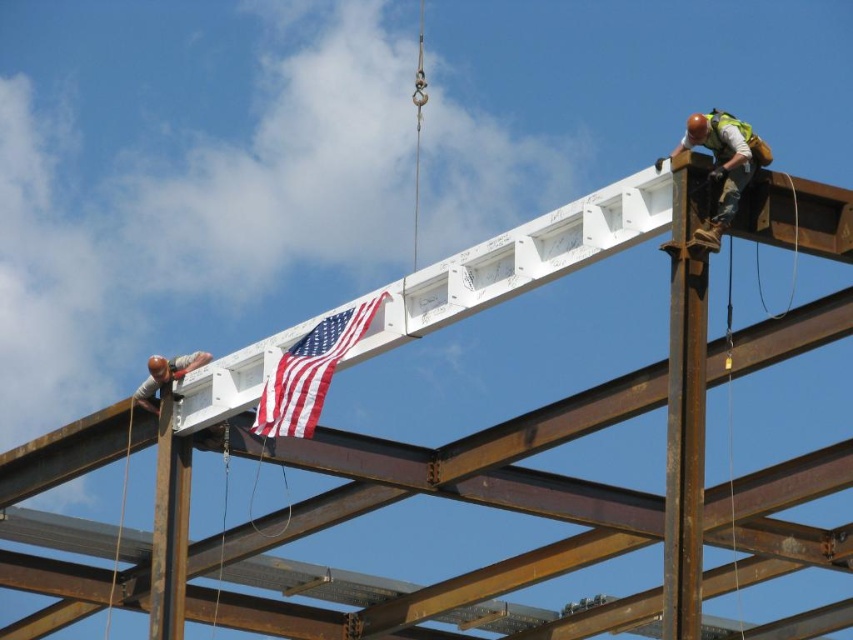
You are a safety inspector on the construction site. You need to ensure that the American flag at center is not in direct contact with the smooth brown pole at lower left. Based on the scene description, is there a risk of contact between these two objects?

The American flag at center is above the smooth brown pole at lower left, so there is no direct contact between them.

You are a safety inspector observing the construction site. You notice two workers near the white beam. Which worker is standing higher up, the hard hat steel worker at upper right or the brushed metal helmet at lower left?

The hard hat steel worker at upper right is positioned over the brushed metal helmet at lower left, so the hard hat steel worker at upper right is standing higher up.

You are a safety inspector reviewing this construction site. You notice the american flag at center and the smooth brown pole at lower left. According to safety protocols, the flag should not be placed in a position where it could come into contact with the pole. Based on their positions, is there a potential safety issue here?

The american flag at center is to the right of the smooth brown pole at lower left, so there is a potential safety issue because the flag is positioned in a way that it could come into contact with the pole during movement.